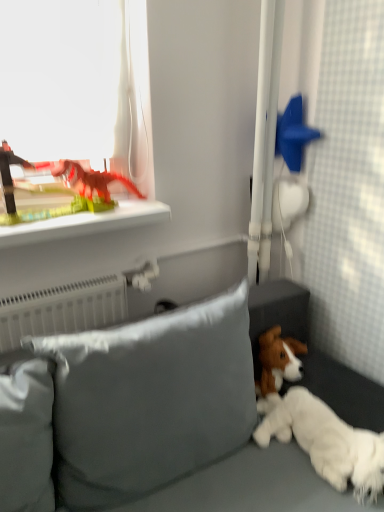
Where is `vacant space positioned to the left of white fluffy dog at lower right`? This screenshot has width=384, height=512. vacant space positioned to the left of white fluffy dog at lower right is located at coordinates (233, 475).